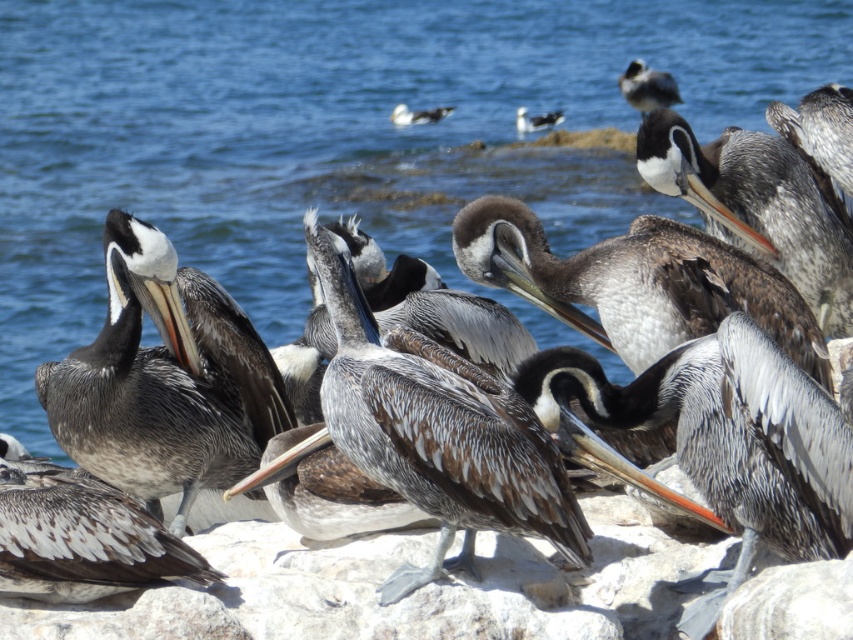
You are a photographer trying to capture the pelicans on the rocky shoreline. You notice two points in your viewfinder labeled as point (624, 90) and point (525, 129). Which point is closer to your camera lens?

Point (624, 90) is further to the camera than point (525, 129), so the point closer to your camera lens is point (525, 129).

You are observing a group of birds on a rocky shoreline. You see a brown speckled pelican at center and a white glossy seagull at center. Which bird is positioned to the left?

The brown speckled pelican at center is to the left of the white glossy seagull at center.